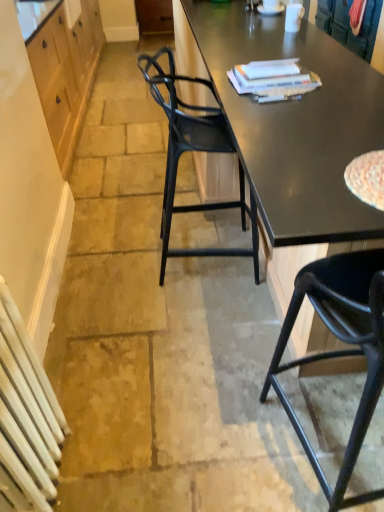
Locate an element on the screen. Image resolution: width=384 pixels, height=512 pixels. free space between white painted metal radiator at lower left and black plastic chair at lower right, which is the 2th chair in back-to-front order is located at coordinates (172, 453).